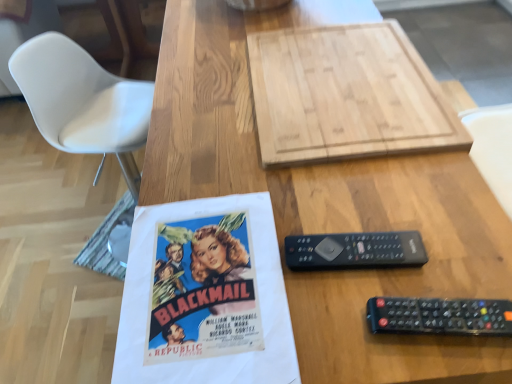
I want to click on free point below natural wood cutting board at upper center (from a real-world perspective), so click(x=347, y=86).